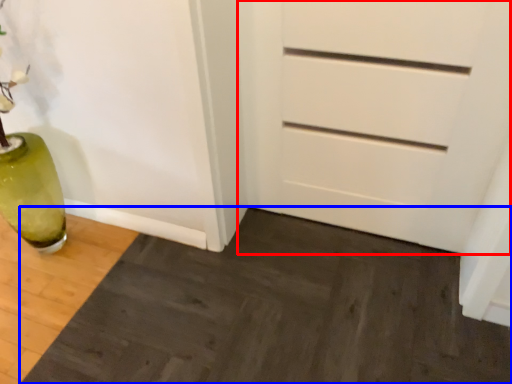
Question: Which of the following is the farthest to the observer, chest of drawers (highlighted by a red box) or doormat (highlighted by a blue box)?

Choices:
 (A) chest of drawers
 (B) doormat

Answer: (A)